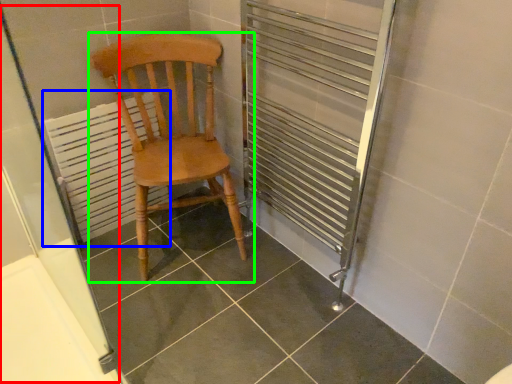
Question: Which is nearer to the screen door (highlighted by a red box)? radiator (highlighted by a blue box) or chair (highlighted by a green box).

Choices:
 (A) radiator
 (B) chair

Answer: (A)